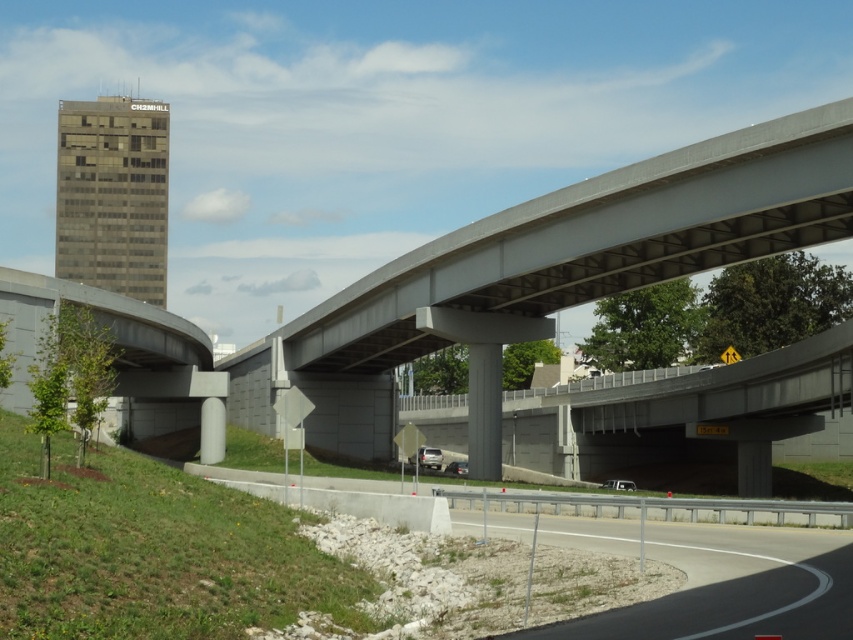
Is dark gray glass building at upper left shorter than gray concrete pillar at center?

In fact, dark gray glass building at upper left may be taller than gray concrete pillar at center.

Does point (148, 156) come closer to viewer compared to point (500, 390)?

That is False.

Who is more forward, (126, 268) or (480, 401)?

Point (480, 401) is more forward.

In order to click on dark gray glass building at upper left in this screenshot , I will do `click(113, 195)`.

Does gray concrete pillar at center have a larger size compared to metallic silver sedan at center?

Indeed, gray concrete pillar at center has a larger size compared to metallic silver sedan at center.

Which is below, gray concrete pillar at center or metallic silver sedan at center?

Positioned lower is metallic silver sedan at center.

At what (x,y) coordinates should I click in order to perform the action: click on gray concrete pillar at center. Please return your answer as a coordinate pair (x, y). This screenshot has height=640, width=853. Looking at the image, I should click on (485, 410).

At what (x,y) coordinates should I click in order to perform the action: click on gray concrete pillar at center. Please return your answer as a coordinate pair (x, y). Looking at the image, I should click on (485, 410).

Can you confirm if gray concrete pillar at center is bigger than satin silver sedan at center?

Actually, gray concrete pillar at center might be smaller than satin silver sedan at center.

Is gray concrete pillar at center further to camera compared to satin silver sedan at center?

Yes, gray concrete pillar at center is further from the viewer.

The height and width of the screenshot is (640, 853). Find the location of `gray concrete pillar at center`. gray concrete pillar at center is located at coordinates (485, 410).